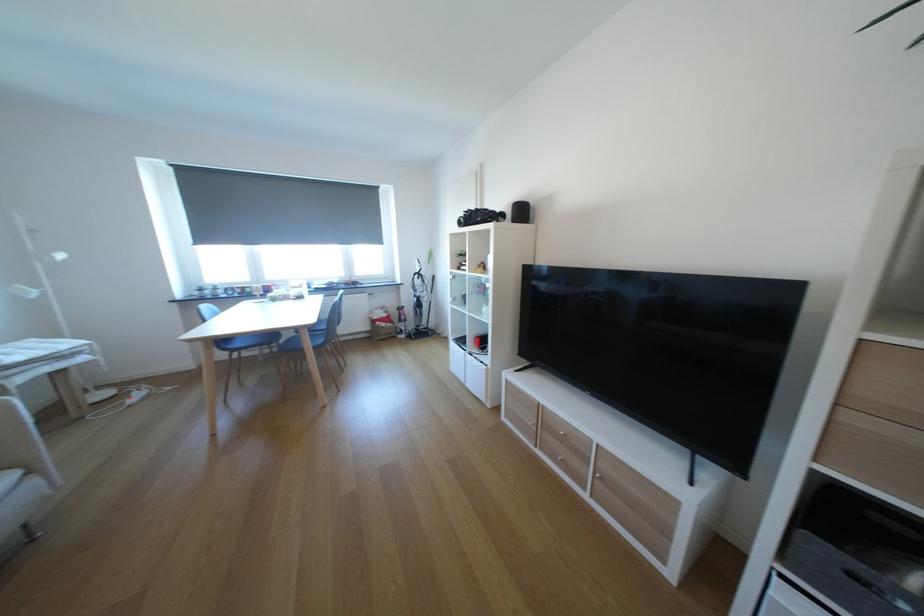
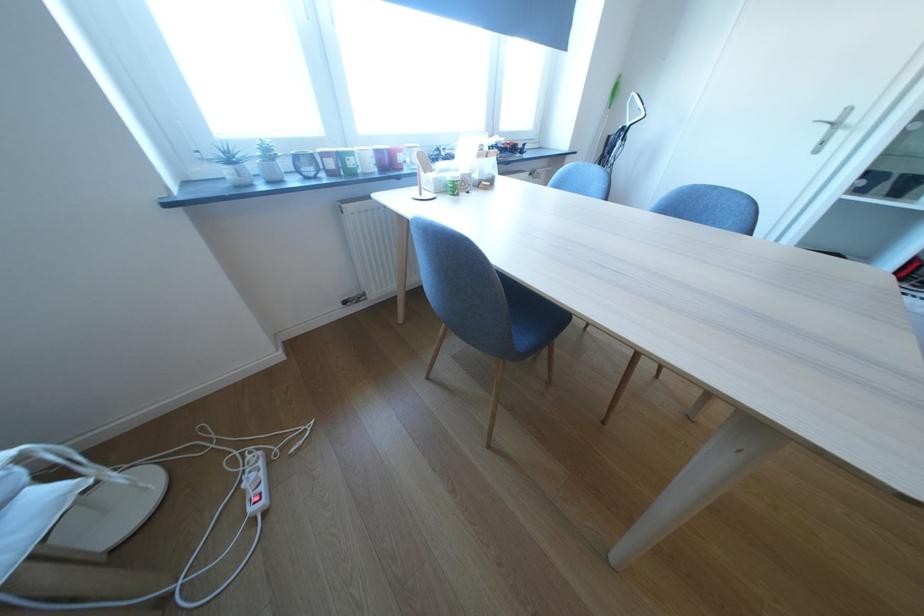
Where in the second image is the point corresponding to (212,294) from the first image?

(249, 175)